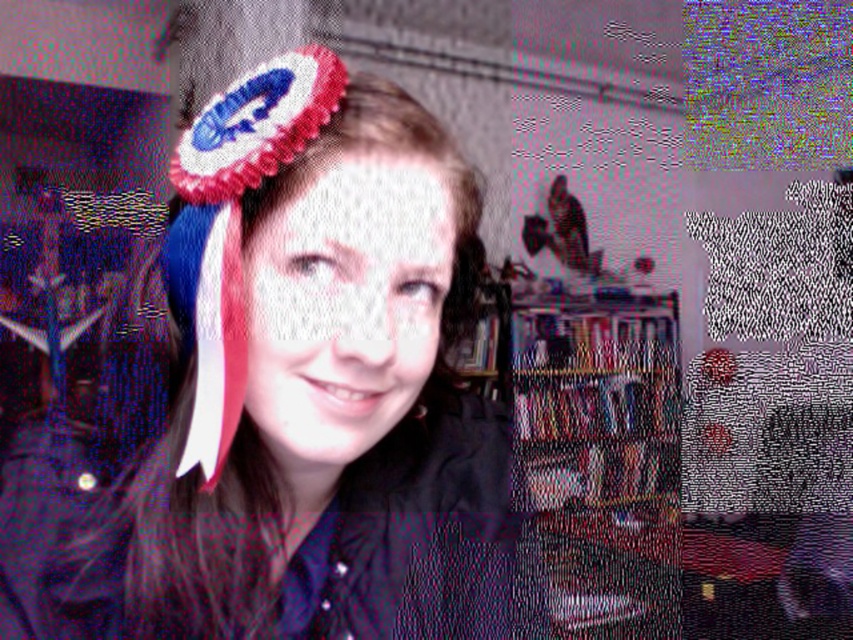
Question: Which of the following is the farthest from the observer?

Choices:
 (A) (664, 440)
 (B) (357, 173)
 (C) (364, 96)

Answer: (A)

Question: Observing the image, what is the correct spatial positioning of matte fabric headband at center in reference to wooden bookshelf at center?

Choices:
 (A) left
 (B) right

Answer: (A)

Question: Which of the following is the closest to the observer?

Choices:
 (A) (281, 292)
 (B) (256, 244)
 (C) (618, 323)

Answer: (A)

Question: Is fuzzy fabric headband at upper center thinner than matte fabric headband at center?

Choices:
 (A) no
 (B) yes

Answer: (A)

Question: Which point is closer to the camera?

Choices:
 (A) (263, 220)
 (B) (564, 358)
 (C) (119, 513)

Answer: (A)

Question: Can you confirm if fuzzy fabric headband at upper center is positioned to the right of wooden bookshelf at center?

Choices:
 (A) yes
 (B) no

Answer: (B)